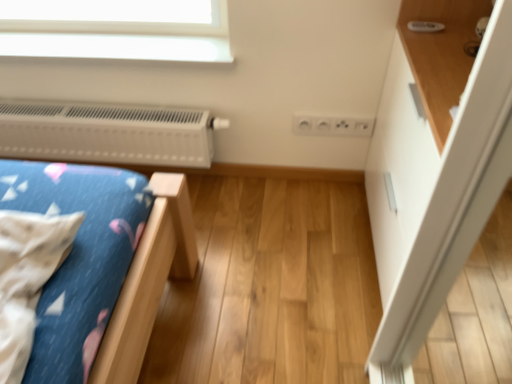
Question: Is the depth of white glossy dresser at upper right less than that of wooden shelf at upper right?

Choices:
 (A) no
 (B) yes

Answer: (A)

Question: From a real-world perspective, is white glossy dresser at upper right positioned over wooden shelf at upper right based on gravity?

Choices:
 (A) yes
 (B) no

Answer: (B)

Question: Is white glossy dresser at upper right outside wooden shelf at upper right?

Choices:
 (A) no
 (B) yes

Answer: (B)

Question: Can you confirm if white glossy dresser at upper right is wider than wooden shelf at upper right?

Choices:
 (A) no
 (B) yes

Answer: (B)

Question: From the image's perspective, would you say white glossy dresser at upper right is shown under wooden shelf at upper right?

Choices:
 (A) no
 (B) yes

Answer: (B)

Question: From a real-world perspective, is white glossy dresser at upper right beneath wooden shelf at upper right?

Choices:
 (A) no
 (B) yes

Answer: (B)

Question: Is white plastic heater at upper left bigger than white glossy dresser at upper right?

Choices:
 (A) yes
 (B) no

Answer: (B)

Question: Can you confirm if white plastic heater at upper left is smaller than white glossy dresser at upper right?

Choices:
 (A) no
 (B) yes

Answer: (B)

Question: Is white plastic heater at upper left thinner than white glossy dresser at upper right?

Choices:
 (A) yes
 (B) no

Answer: (A)

Question: Is white plastic heater at upper left at the right side of white glossy dresser at upper right?

Choices:
 (A) yes
 (B) no

Answer: (B)

Question: Are white plastic heater at upper left and white glossy dresser at upper right far apart?

Choices:
 (A) yes
 (B) no

Answer: (B)

Question: Is white plastic heater at upper left wider than white glossy dresser at upper right?

Choices:
 (A) no
 (B) yes

Answer: (A)

Question: Is white plastic heater at upper left next to wooden shelf at upper right?

Choices:
 (A) no
 (B) yes

Answer: (A)